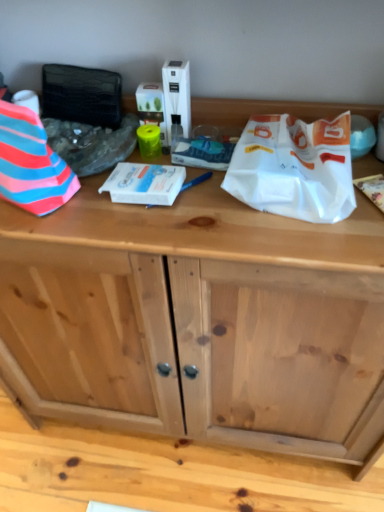
You are a GUI agent. You are given a task and a screenshot of the screen. Output one action in this format:
    pyautogui.click(x=<x>, y=<y>)
    Task: Click on the white paper bag at upper right, which appears as the first wrapping paper when viewed from the right
    
    Given the screenshot: What is the action you would take?
    pyautogui.click(x=294, y=167)

Visually, is white glossy box at center, the second wrapping paper positioned from the left, positioned to the left or to the right of white paper bag at upper right, the 3th wrapping paper positioned from the left?

white glossy box at center, the second wrapping paper positioned from the left, is to the left of white paper bag at upper right, the 3th wrapping paper positioned from the left.

Considering the relative sizes of white glossy box at center, the second wrapping paper positioned from the left, and white paper bag at upper right, which appears as the first wrapping paper when viewed from the right, in the image provided, is white glossy box at center, the second wrapping paper positioned from the left, taller than white paper bag at upper right, which appears as the first wrapping paper when viewed from the right,?

In fact, white glossy box at center, the second wrapping paper positioned from the left, may be shorter than white paper bag at upper right, which appears as the first wrapping paper when viewed from the right.

Is white glossy box at center, the second wrapping paper positioned from the left, surrounding white paper bag at upper right, the 3th wrapping paper positioned from the left?

No, white glossy box at center, the second wrapping paper positioned from the left, does not contain white paper bag at upper right, the 3th wrapping paper positioned from the left.

Based on the photo, is white paper bag at upper right, the 3th wrapping paper positioned from the left, at the back of white glossy box at center, the second wrapping paper positioned from the left?

white glossy box at center, the second wrapping paper positioned from the left, is not turned away from white paper bag at upper right, the 3th wrapping paper positioned from the left.

From a real-world perspective, which is physically below, white glossy box at center, positioned as the 2th wrapping paper in right-to-left order, or striped fabric at left, which is the 1th wrapping paper in left-to-right order?

white glossy box at center, positioned as the 2th wrapping paper in right-to-left order, is physically lower.

Could you measure the distance between white glossy box at center, the second wrapping paper positioned from the left, and striped fabric at left, arranged as the third wrapping paper when viewed from the right?

The distance of white glossy box at center, the second wrapping paper positioned from the left, from striped fabric at left, arranged as the third wrapping paper when viewed from the right, is 4.61 inches.

In the scene shown: Which object is positioned more to the right, white glossy box at center, positioned as the 2th wrapping paper in right-to-left order, or striped fabric at left, which is the 1th wrapping paper in left-to-right order?

white glossy box at center, positioned as the 2th wrapping paper in right-to-left order, is more to the right.

This screenshot has width=384, height=512. In order to click on wrapping paper on the left of the white glossy box at center, the second wrapping paper positioned from the left in this screenshot , I will do `click(31, 163)`.

Considering the sizes of striped fabric at left, which is the 1th wrapping paper in left-to-right order, and white glossy box at center, positioned as the 2th wrapping paper in right-to-left order, in the image, is striped fabric at left, which is the 1th wrapping paper in left-to-right order, wider or thinner than white glossy box at center, positioned as the 2th wrapping paper in right-to-left order,?

Considering their sizes, striped fabric at left, which is the 1th wrapping paper in left-to-right order, looks broader than white glossy box at center, positioned as the 2th wrapping paper in right-to-left order.

Considering the relative positions of striped fabric at left, arranged as the third wrapping paper when viewed from the right, and white glossy box at center, the second wrapping paper positioned from the left, in the image provided, is striped fabric at left, arranged as the third wrapping paper when viewed from the right, in front of white glossy box at center, the second wrapping paper positioned from the left,?

Yes, it is.

Which object is positioned more to the right, striped fabric at left, arranged as the third wrapping paper when viewed from the right, or white glossy box at center, the second wrapping paper positioned from the left?

From the viewer's perspective, white glossy box at center, the second wrapping paper positioned from the left, appears more on the right side.

Is point (262, 209) farther from camera compared to point (141, 172)?

That is False.

Looking at this image, from a real-world perspective, is white paper bag at upper right, the 3th wrapping paper positioned from the left, beneath white glossy box at center, the second wrapping paper positioned from the left?

No, from a real-world perspective, white paper bag at upper right, the 3th wrapping paper positioned from the left, is not below white glossy box at center, the second wrapping paper positioned from the left.

This screenshot has height=512, width=384. I want to click on the 1st wrapping paper to the left when counting from the white paper bag at upper right, which appears as the first wrapping paper when viewed from the right, so click(x=144, y=183).

Is striped fabric at left, arranged as the third wrapping paper when viewed from the right, not close to white paper bag at upper right, which appears as the first wrapping paper when viewed from the right?

They are positioned close to each other.

Based on the photo, considering the positions of objects striped fabric at left, arranged as the third wrapping paper when viewed from the right, and white paper bag at upper right, the 3th wrapping paper positioned from the left, in the image provided, who is behind, striped fabric at left, arranged as the third wrapping paper when viewed from the right, or white paper bag at upper right, the 3th wrapping paper positioned from the left,?

white paper bag at upper right, the 3th wrapping paper positioned from the left, is further from the camera.

How many degrees apart are the facing directions of striped fabric at left, which is the 1th wrapping paper in left-to-right order, and white paper bag at upper right, the 3th wrapping paper positioned from the left?

27.5 degrees separate the facing orientations of striped fabric at left, which is the 1th wrapping paper in left-to-right order, and white paper bag at upper right, the 3th wrapping paper positioned from the left.

Considering the points (51, 150) and (277, 120), which point is in front, point (51, 150) or point (277, 120)?

The point (51, 150) is closer.

Is there a large distance between white paper bag at upper right, the 3th wrapping paper positioned from the left, and striped fabric at left, which is the 1th wrapping paper in left-to-right order?

No, white paper bag at upper right, the 3th wrapping paper positioned from the left, is not far away from striped fabric at left, which is the 1th wrapping paper in left-to-right order.

From the image's perspective, relative to striped fabric at left, which is the 1th wrapping paper in left-to-right order, is white paper bag at upper right, the 3th wrapping paper positioned from the left, above or below?

Clearly, from the image's perspective, white paper bag at upper right, the 3th wrapping paper positioned from the left, is below striped fabric at left, which is the 1th wrapping paper in left-to-right order.

From a real-world perspective, is white paper bag at upper right, the 3th wrapping paper positioned from the left, positioned over striped fabric at left, which is the 1th wrapping paper in left-to-right order, based on gravity?

Actually, white paper bag at upper right, the 3th wrapping paper positioned from the left, is physically below striped fabric at left, which is the 1th wrapping paper in left-to-right order, in the real world.

Considering the positions of objects white paper bag at upper right, which appears as the first wrapping paper when viewed from the right, and striped fabric at left, which is the 1th wrapping paper in left-to-right order, in the image provided, who is in front, white paper bag at upper right, which appears as the first wrapping paper when viewed from the right, or striped fabric at left, which is the 1th wrapping paper in left-to-right order,?

striped fabric at left, which is the 1th wrapping paper in left-to-right order, is in front.

Locate an element on the screen. Image resolution: width=384 pixels, height=512 pixels. wrapping paper behind the white paper bag at upper right, the 3th wrapping paper positioned from the left is located at coordinates (144, 183).

I want to click on wrapping paper that is the 2nd one when counting downward from the striped fabric at left, arranged as the third wrapping paper when viewed from the right (from the image's perspective), so click(x=144, y=183).

Based on the photo, estimate the real-world distances between objects in this image. Which object is further from white glossy box at center, positioned as the 2th wrapping paper in right-to-left order, white paper bag at upper right, which appears as the first wrapping paper when viewed from the right, or striped fabric at left, arranged as the third wrapping paper when viewed from the right?

white paper bag at upper right, which appears as the first wrapping paper when viewed from the right.

Based on their spatial positions, is striped fabric at left, which is the 1th wrapping paper in left-to-right order, or white glossy box at center, the second wrapping paper positioned from the left, closer to white paper bag at upper right, the 3th wrapping paper positioned from the left?

Based on the image, white glossy box at center, the second wrapping paper positioned from the left, appears to be nearer to white paper bag at upper right, the 3th wrapping paper positioned from the left.

Estimate the real-world distances between objects in this image. Which object is closer to striped fabric at left, arranged as the third wrapping paper when viewed from the right, white glossy box at center, positioned as the 2th wrapping paper in right-to-left order, or white paper bag at upper right, the 3th wrapping paper positioned from the left?

Based on the image, white glossy box at center, positioned as the 2th wrapping paper in right-to-left order, appears to be nearer to striped fabric at left, arranged as the third wrapping paper when viewed from the right.

Based on their spatial positions, is striped fabric at left, which is the 1th wrapping paper in left-to-right order, or white paper bag at upper right, the 3th wrapping paper positioned from the left, further from white glossy box at center, positioned as the 2th wrapping paper in right-to-left order?

white paper bag at upper right, the 3th wrapping paper positioned from the left, is further to white glossy box at center, positioned as the 2th wrapping paper in right-to-left order.

Estimate the real-world distances between objects in this image. Which object is closer to striped fabric at left, arranged as the third wrapping paper when viewed from the right, white paper bag at upper right, which appears as the first wrapping paper when viewed from the right, or white glossy box at center, positioned as the 2th wrapping paper in right-to-left order?

white glossy box at center, positioned as the 2th wrapping paper in right-to-left order, is closer to striped fabric at left, arranged as the third wrapping paper when viewed from the right.

When comparing their distances from white paper bag at upper right, the 3th wrapping paper positioned from the left, does white glossy box at center, positioned as the 2th wrapping paper in right-to-left order, or striped fabric at left, which is the 1th wrapping paper in left-to-right order, seem closer?

Among the two, white glossy box at center, positioned as the 2th wrapping paper in right-to-left order, is located nearer to white paper bag at upper right, the 3th wrapping paper positioned from the left.

I want to click on wrapping paper between striped fabric at left, arranged as the third wrapping paper when viewed from the right, and white paper bag at upper right, the 3th wrapping paper positioned from the left, in the horizontal direction, so click(144, 183).